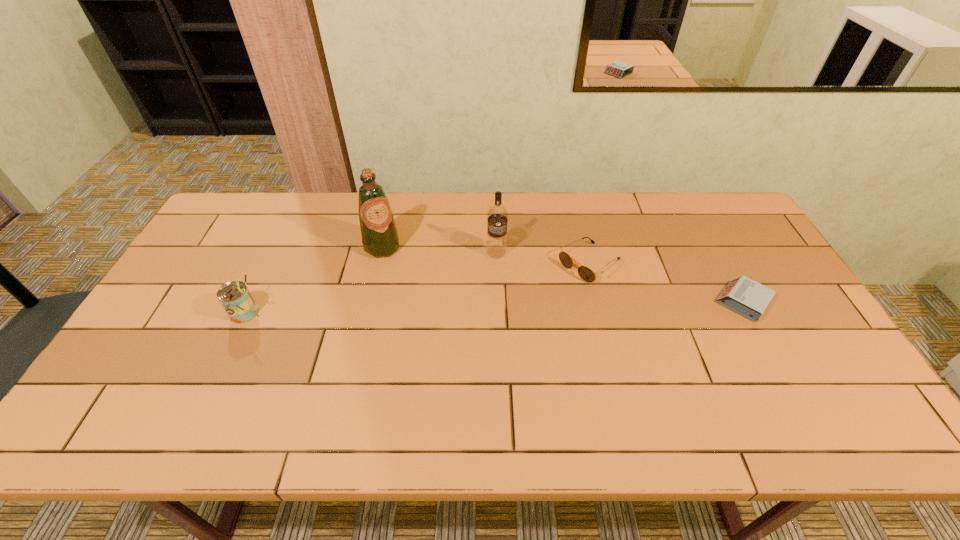
Where is `free space located 0.190m on the lenses of the sunglasses`? The height and width of the screenshot is (540, 960). free space located 0.190m on the lenses of the sunglasses is located at coordinates (523, 310).

The image size is (960, 540). What are the coordinates of `object that is at the far edge` in the screenshot? It's located at (380, 239).

At what (x,y) coordinates should I click in order to perform the action: click on object that is at the right edge. Please return your answer as a coordinate pair (x, y). Looking at the image, I should click on pos(745,296).

Where is `free space at the far edge`? The image size is (960, 540). free space at the far edge is located at coordinates (300, 196).

You are a GUI agent. You are given a task and a screenshot of the screen. Output one action in this format:
    pyautogui.click(x=<x>, y=<y>)
    Task: Click on the blank space at the near edge of the desktop
    This screenshot has height=540, width=960.
    Given the screenshot: What is the action you would take?
    pyautogui.click(x=669, y=373)

At what (x,y) coordinates should I click in order to perform the action: click on vacant space at the right edge of the desktop. Please return your answer as a coordinate pair (x, y). The height and width of the screenshot is (540, 960). Looking at the image, I should click on (756, 243).

In the image, there is a desktop. Identify the location of vacant space at the far left corner. (247, 234).

Locate an element on the screen. Image resolution: width=960 pixels, height=540 pixels. free space at the far right corner of the desktop is located at coordinates (720, 207).

At what (x,y) coordinates should I click in order to perform the action: click on free point between the rightmost object and the leftmost object. Please return your answer as a coordinate pair (x, y). The width and height of the screenshot is (960, 540). Looking at the image, I should click on (493, 307).

At what (x,y) coordinates should I click in order to perform the action: click on unoccupied area between the third tallest object and the olive oil. Please return your answer as a coordinate pair (x, y). Looking at the image, I should click on (314, 280).